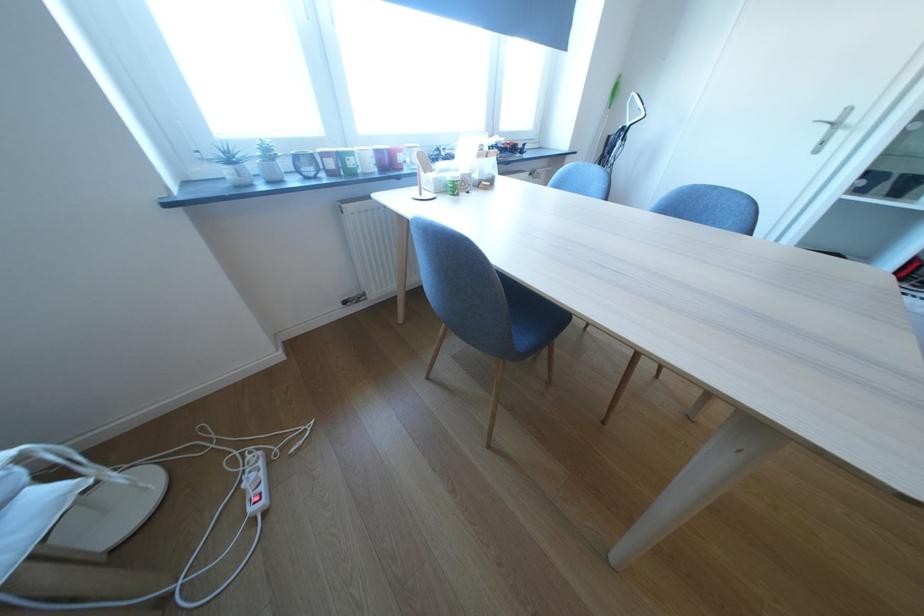
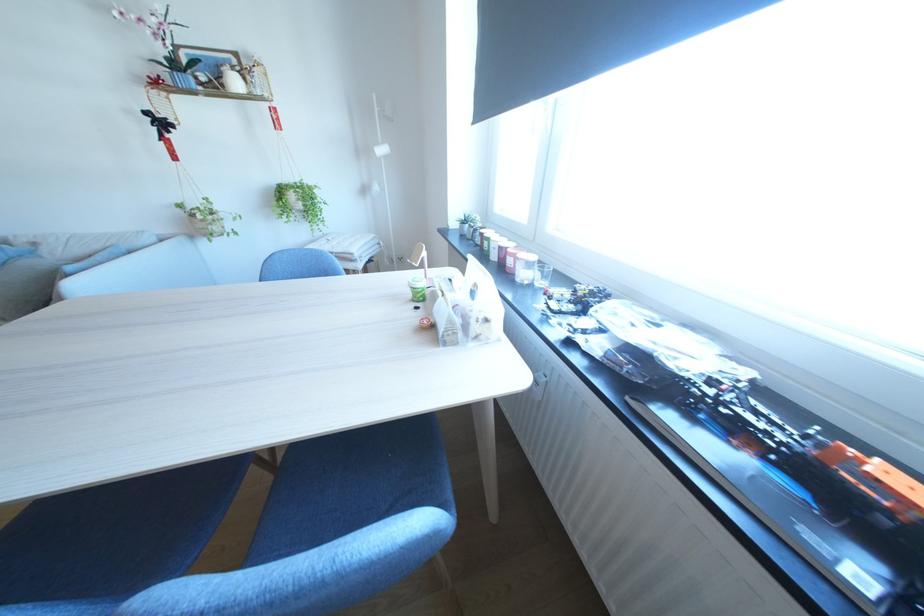
The point at (408, 156) is marked in the first image. Where is the corresponding point in the second image?

(518, 257)